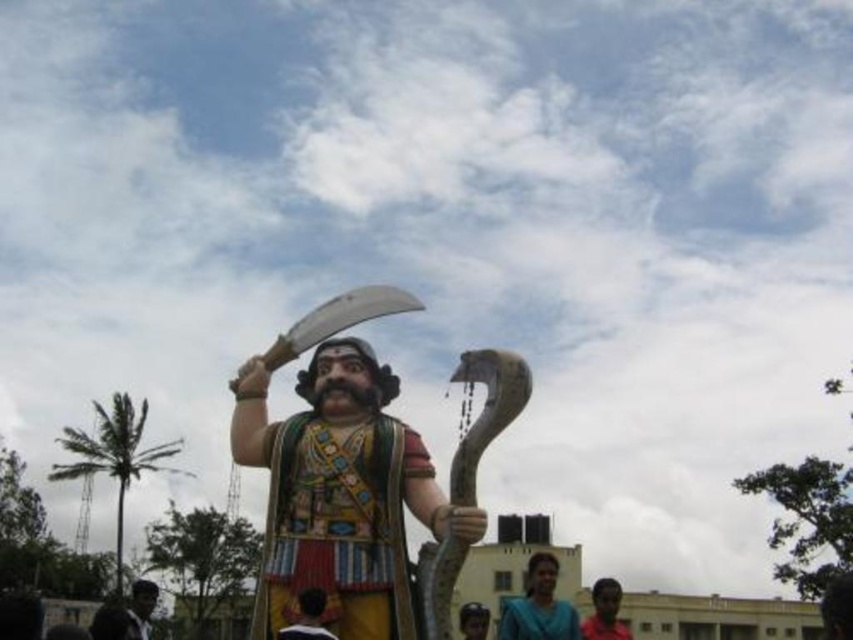
You are standing in front of the statue and want to take a photo of both the polished wood statue at center and the smooth brown hair at center. Which object should you position to your left to capture both in the frame?

You should position the smooth brown hair at center to your left since the polished wood statue at center is to the right of it, allowing both to be captured in the frame.